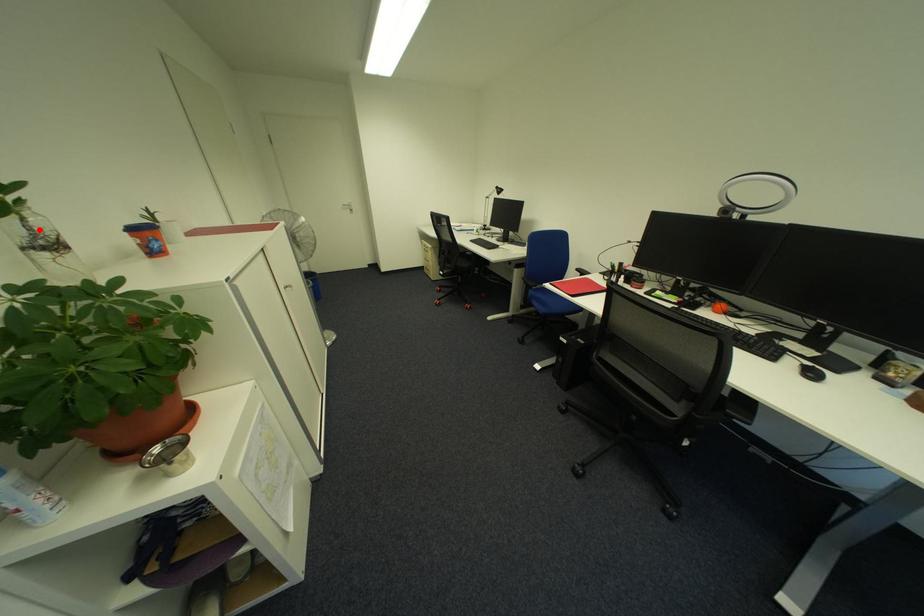
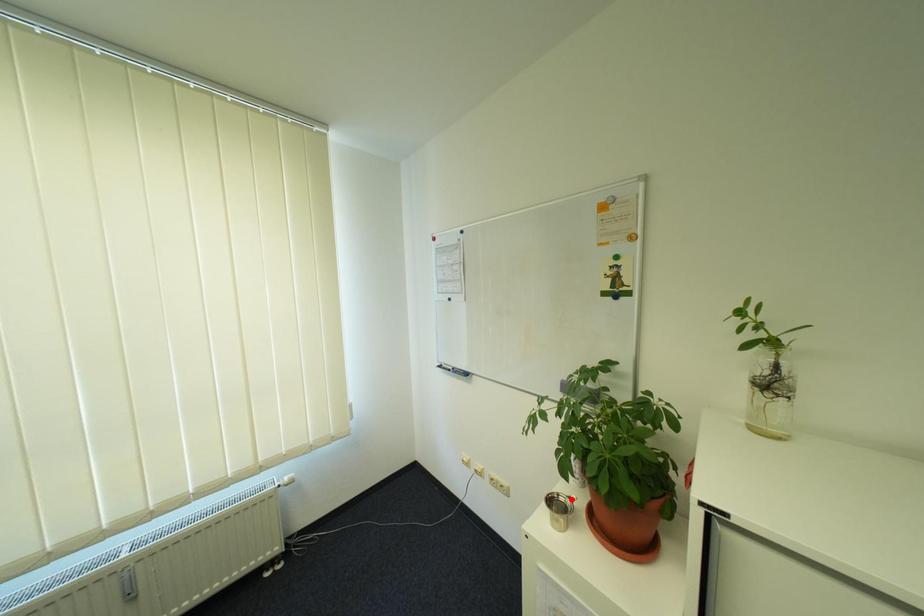
I am providing you with two images of the same scene from different viewpoints. A red point is marked on the first image and another point is marked on the second image. Is the red point in image1 aligned with the point shown in image2?

No